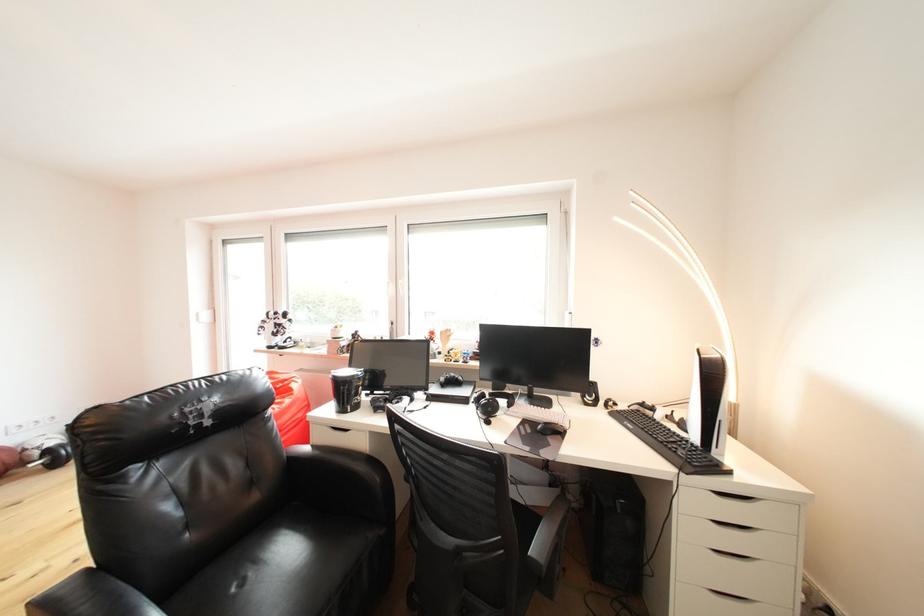
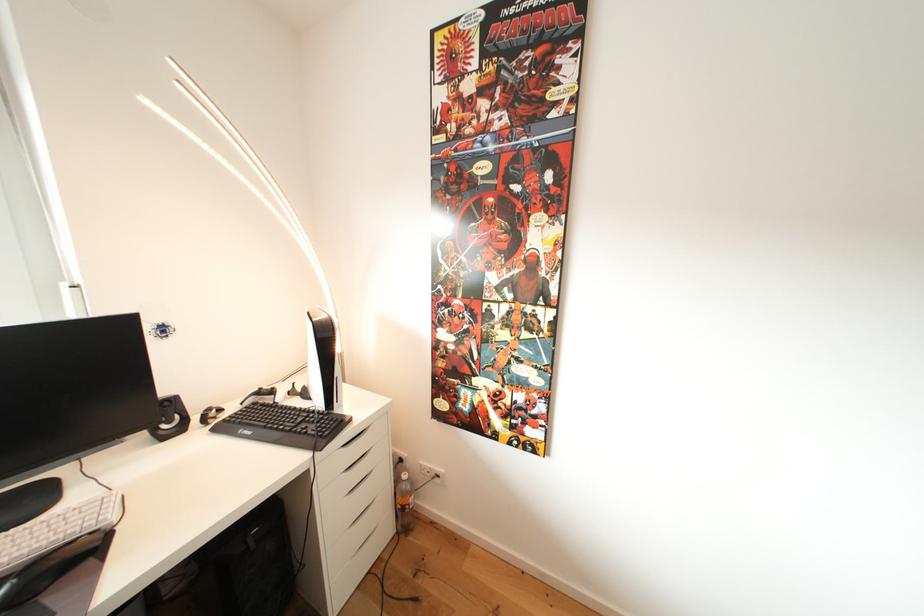
Question: The camera is either moving clockwise (left) or counter-clockwise (right) around the object. The first image is from the beginning of the video and the second image is from the end. Is the camera moving left or right when shooting the video?

Choices:
 (A) Left
 (B) Right

Answer: (A)